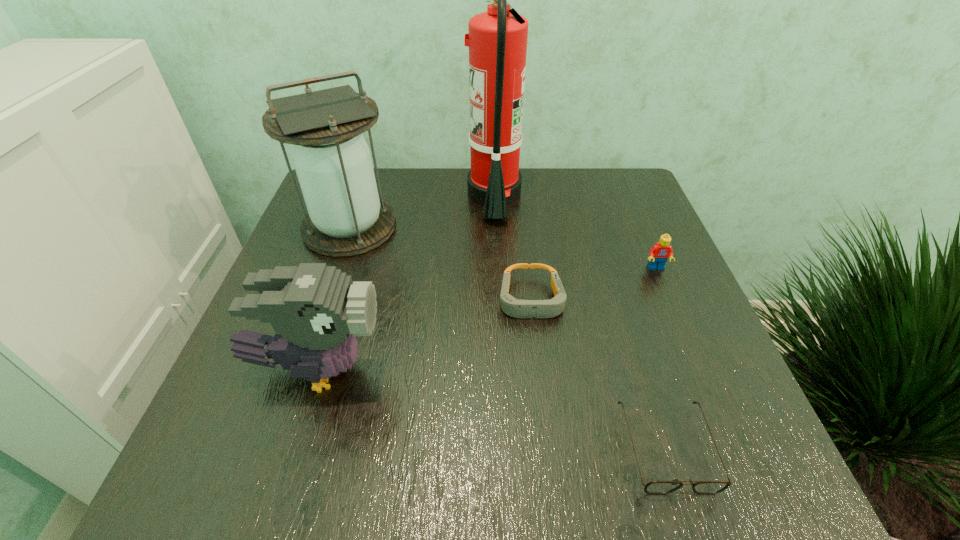
Where is `vacant region located at the nozzle of the fire extinguisher`? This screenshot has width=960, height=540. vacant region located at the nozzle of the fire extinguisher is located at coordinates (406, 195).

Where is `free space located at the nozzle of the fire extinguisher`? free space located at the nozzle of the fire extinguisher is located at coordinates tap(375, 195).

Find the location of a particular element. The height and width of the screenshot is (540, 960). vacant position located on the front of the fifth shortest object is located at coordinates (326, 295).

In order to click on free space located 0.400m at the beak of the bird in this screenshot , I will do `click(617, 370)`.

This screenshot has width=960, height=540. What are the coordinates of `free region located 0.220m on the face of the third farthest object` in the screenshot? It's located at (694, 357).

Where is `vacant area situated 0.110m on the front and back of the goggles`? The width and height of the screenshot is (960, 540). vacant area situated 0.110m on the front and back of the goggles is located at coordinates (540, 377).

Locate an element on the screen. The width and height of the screenshot is (960, 540). fire extinguisher that is at the far edge is located at coordinates (497, 39).

The height and width of the screenshot is (540, 960). I want to click on lantern located in the far edge section of the desktop, so click(x=332, y=160).

The width and height of the screenshot is (960, 540). In order to click on object situated at the near edge in this screenshot , I will do `click(654, 487)`.

Where is `lantern at the left edge`? This screenshot has height=540, width=960. lantern at the left edge is located at coordinates (332, 160).